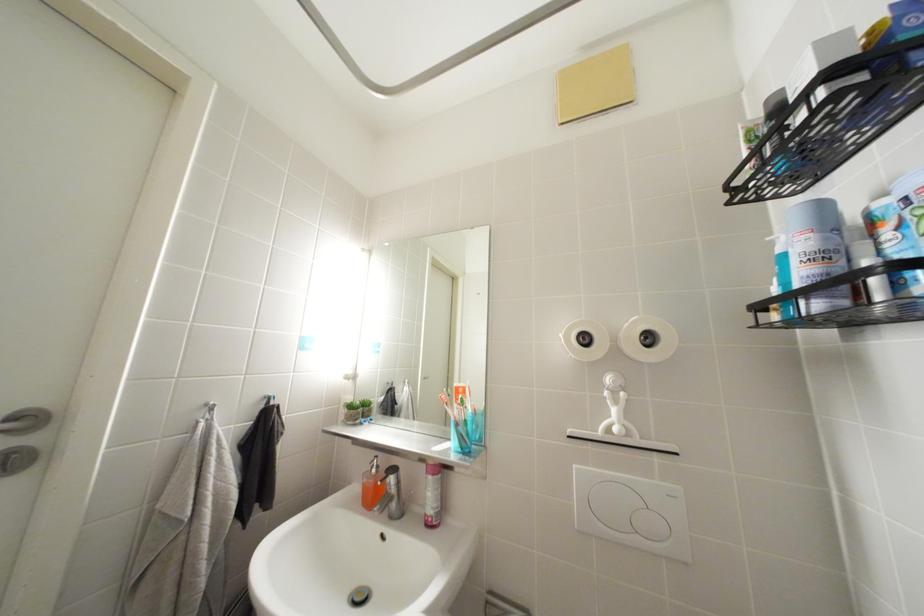
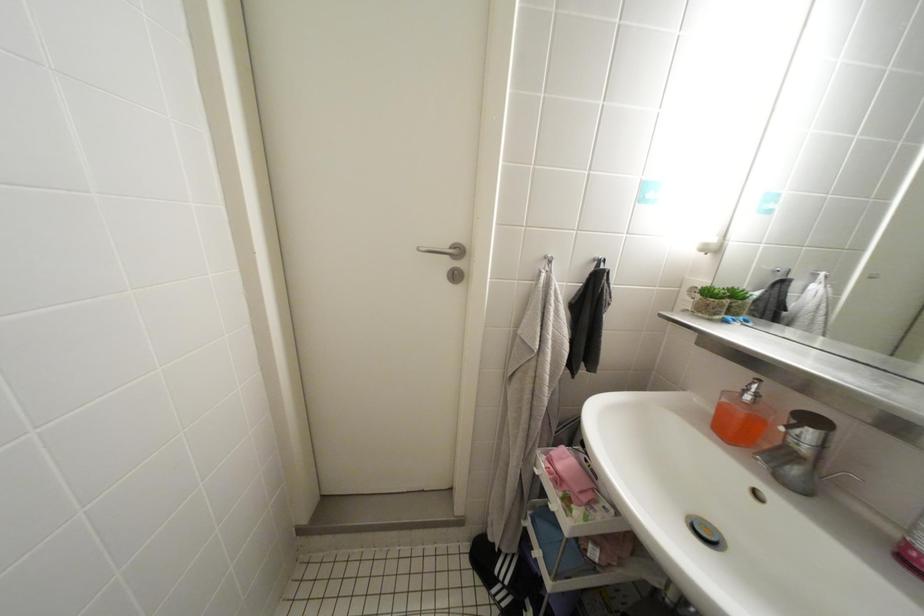
First-person continuous shooting, in which direction is the camera rotating?

The camera's rotation is toward left-down.